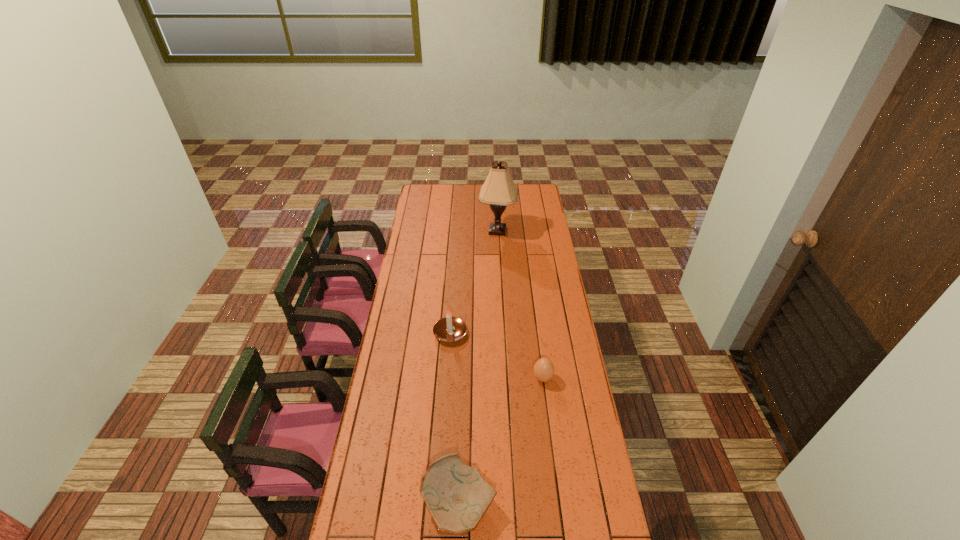
Image resolution: width=960 pixels, height=540 pixels. In the image, there is a desktop. What are the coordinates of `free region at the left edge` in the screenshot? It's located at (430, 274).

Where is `vacant space at the right edge of the desktop`? vacant space at the right edge of the desktop is located at coordinates (548, 341).

Find the location of a particular element. blank area at the far right corner is located at coordinates (544, 195).

Find the location of `vacant space in between the second tallest object and the boiled egg`. vacant space in between the second tallest object and the boiled egg is located at coordinates (496, 355).

Identify the location of free area in between the third shortest object and the third farthest object. This screenshot has width=960, height=540. (496, 355).

Find the location of a particular element. The height and width of the screenshot is (540, 960). free spot between the third shortest object and the farthest object is located at coordinates (473, 282).

You are a GUI agent. You are given a task and a screenshot of the screen. Output one action in this format:
    pyautogui.click(x=<x>, y=<y>)
    Task: Click on the vacant space that is in between the second nearest object and the candle
    This screenshot has height=540, width=960.
    Given the screenshot: What is the action you would take?
    pyautogui.click(x=496, y=355)

The width and height of the screenshot is (960, 540). I want to click on vacant point located between the third farthest object and the third shortest object, so click(x=496, y=355).

Locate an element on the screen. free space between the boiled egg and the second farthest object is located at coordinates (496, 355).

Locate an element on the screen. Image resolution: width=960 pixels, height=540 pixels. empty space that is in between the second tallest object and the boiled egg is located at coordinates (496, 355).